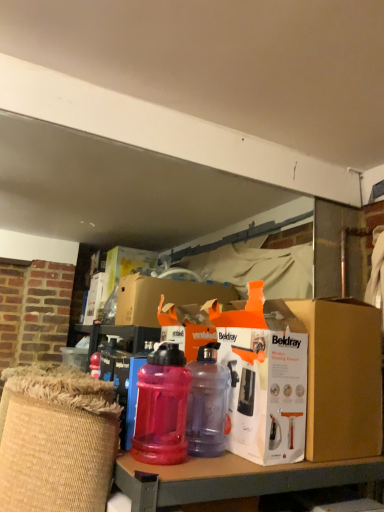
Question: From the image's perspective, is orange cardboard box at center located above or below translucent plastic water bottle at center, which is the second bottle from left to right?

Choices:
 (A) above
 (B) below

Answer: (A)

Question: Which is correct: orange cardboard box at center is inside translucent plastic water bottle at center, placed as the first bottle when sorted from right to left, or outside of it?

Choices:
 (A) inside
 (B) outside

Answer: (B)

Question: Which object is positioned closest to the orange cardboard box at center?

Choices:
 (A) translucent plastic water bottle at center, which is the second bottle from left to right
 (B) translucent plastic water bottle at center, the second bottle in the right-to-left sequence
 (C) white cardboard box at center

Answer: (C)

Question: Which of these objects is positioned closest to the translucent plastic water bottle at center, which is the first bottle from left to right?

Choices:
 (A) translucent plastic water bottle at center, placed as the first bottle when sorted from right to left
 (B) white cardboard box at center
 (C) orange cardboard box at center

Answer: (A)